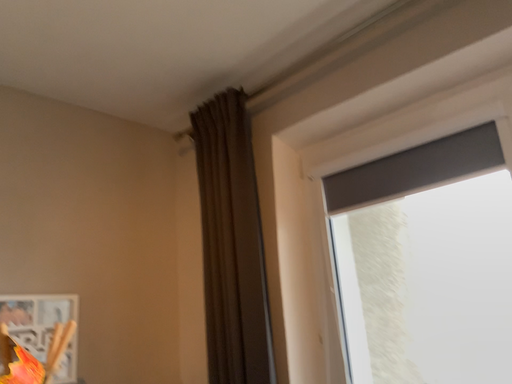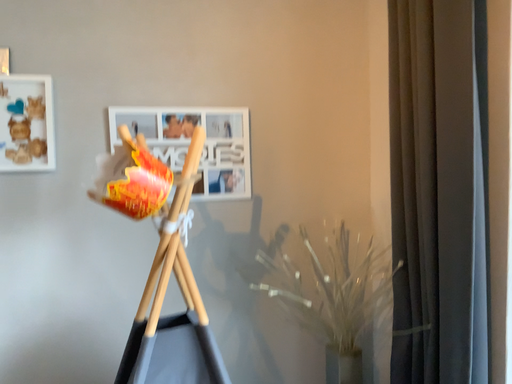
Question: How did the camera likely rotate when shooting the video?

Choices:
 (A) rotated upward
 (B) rotated downward

Answer: (B)